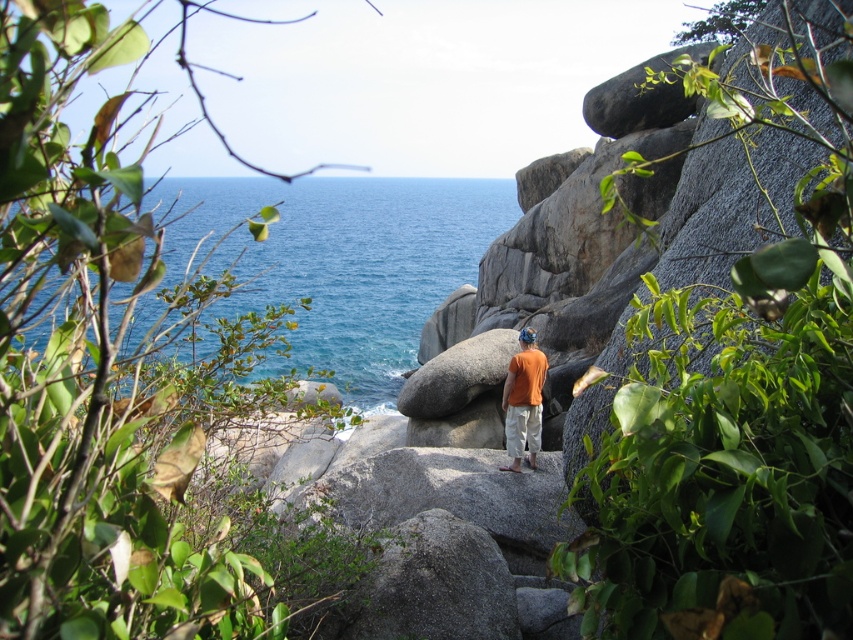
In the scene shown: You are standing in the coastal scene and see the blue water at center and the orange cotton shirt at center. Which object is positioned to the left?

The blue water at center is to the left of the orange cotton shirt at center.

You are standing at the center of the rocky outcrop and want to reach the blue water at center. According to the coordinates provided, in which direction should you move to reach it?

The blue water at center is located at coordinates point (341, 262). Since you are at the center of the rocky outcrop, you should move towards the coordinates provided to reach the blue water at center.